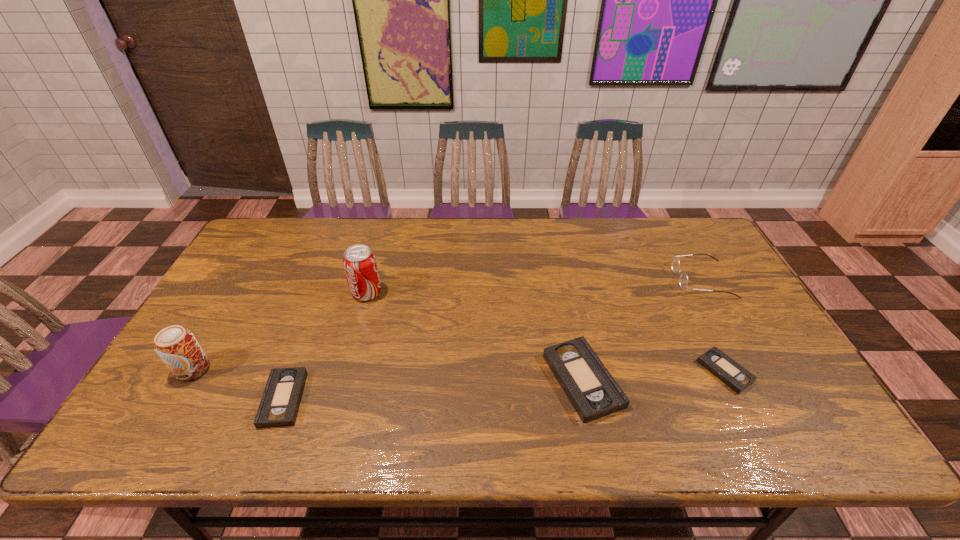
Image resolution: width=960 pixels, height=540 pixels. I want to click on free spot between the fourth object from left to right and the spectacles, so (x=642, y=330).

You are a GUI agent. You are given a task and a screenshot of the screen. Output one action in this format:
    pyautogui.click(x=<x>, y=<y>)
    Task: Click on the free space between the fourth tallest object and the soda
    This screenshot has width=960, height=540.
    Given the screenshot: What is the action you would take?
    pyautogui.click(x=475, y=336)

At what (x,y) coordinates should I click in order to perform the action: click on free space between the soda and the third object from right to left. Please return your answer as a coordinate pair (x, y). Image resolution: width=960 pixels, height=540 pixels. Looking at the image, I should click on (475, 336).

The width and height of the screenshot is (960, 540). In order to click on empty location between the spectacles and the leftmost videotape in this screenshot , I will do `click(492, 339)`.

Find the location of a particular element. Image resolution: width=960 pixels, height=540 pixels. free space between the second tallest object and the fourth object from left to right is located at coordinates (388, 375).

The width and height of the screenshot is (960, 540). In order to click on vacant area between the tallest object and the rightmost videotape in this screenshot , I will do `click(545, 332)`.

This screenshot has height=540, width=960. What are the coordinates of `free space between the fifth object from right to left and the shortest object` in the screenshot? It's located at (504, 385).

What are the coordinates of `vacant area that lies between the spectacles and the shortest object` in the screenshot? It's located at (713, 326).

Where is `vacant space in between the third shortest object and the leftmost object`? vacant space in between the third shortest object and the leftmost object is located at coordinates (388, 375).

Where is `empty location between the shortest object and the tallest object`? Image resolution: width=960 pixels, height=540 pixels. empty location between the shortest object and the tallest object is located at coordinates (545, 332).